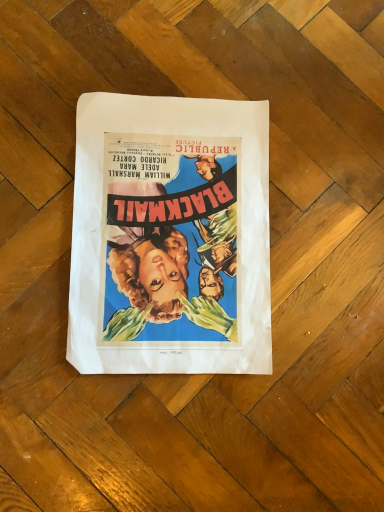
This screenshot has height=512, width=384. Identify the location of free space above matte paper poster at center (from a real-world perspective). (187, 217).